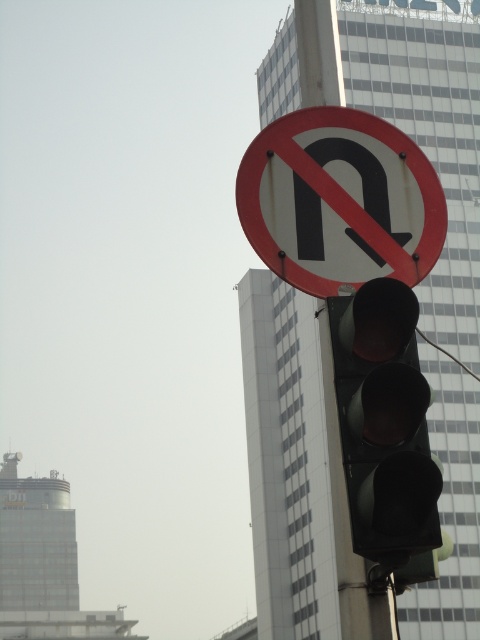
Can you confirm if red painted circle at upper center is positioned to the right of black matte traffic light at center?

No, red painted circle at upper center is not to the right of black matte traffic light at center.

Identify the location of red painted circle at upper center. This screenshot has height=640, width=480. (339, 200).